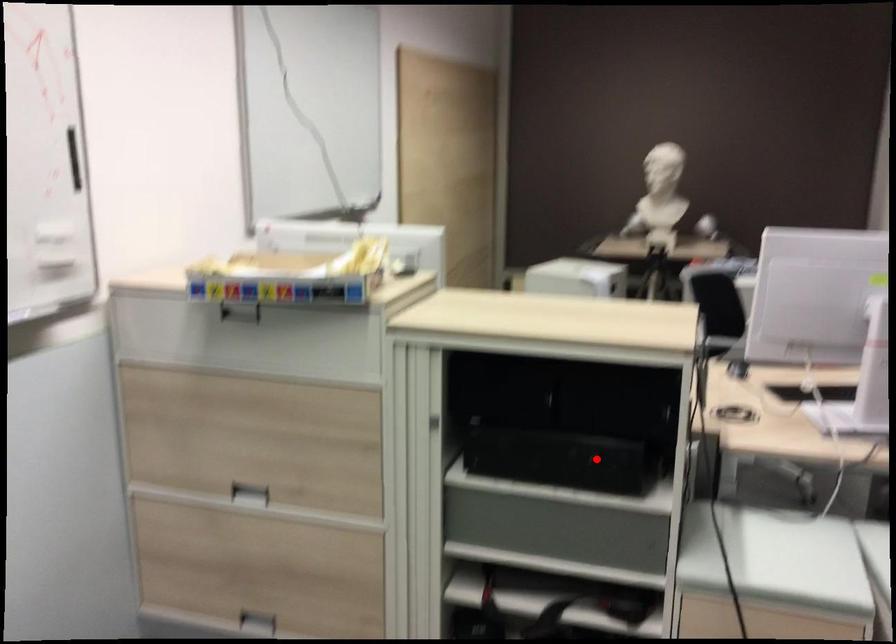
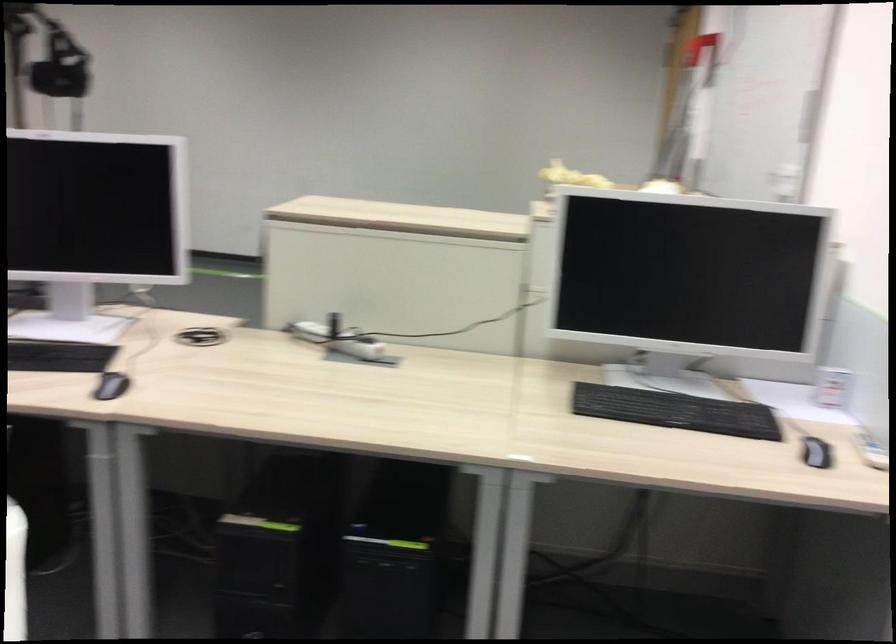
Question: I am providing you with two images of the same scene from different viewpoints. A red point is marked on the first image. At the location where the point appears in image 1, is it still visible in image 2?

Choices:
 (A) Yes
 (B) No

Answer: (B)